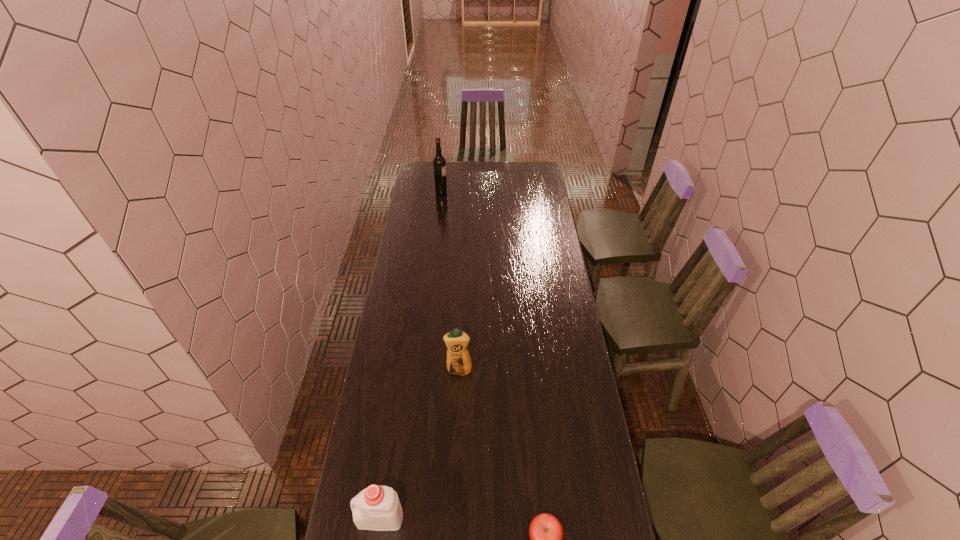
In the image, there is a desktop. Where is `vacant space at the left edge`? This screenshot has height=540, width=960. vacant space at the left edge is located at coordinates (414, 303).

What are the coordinates of `free space at the right edge of the desktop` in the screenshot? It's located at (575, 382).

The width and height of the screenshot is (960, 540). What are the coordinates of `free space at the far right corner of the desktop` in the screenshot? It's located at click(529, 167).

In order to click on vacant point located between the second farthest object and the second shortest object in this screenshot , I will do `click(420, 444)`.

This screenshot has height=540, width=960. I want to click on vacant region between the farthest object and the left detergent, so click(x=411, y=355).

Locate an element on the screen. This screenshot has width=960, height=540. vacant space in between the farthest object and the third tallest object is located at coordinates (411, 355).

The image size is (960, 540). Identify the location of free space between the farthest object and the third object from left to right. (450, 281).

Locate an element on the screen. The image size is (960, 540). empty space that is in between the shorter detergent and the tallest object is located at coordinates (411, 355).

Identify the location of the third closest object to the wine bottle. This screenshot has height=540, width=960. (546, 533).

This screenshot has height=540, width=960. In order to click on object that is the nearest to the shorter detergent in this screenshot , I will do `click(546, 533)`.